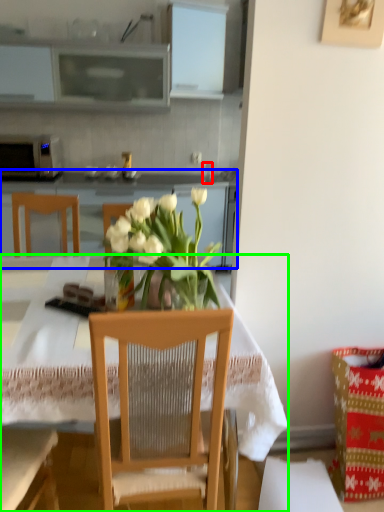
Question: Which object is the closest to the coffee cup (highlighted by a red box)? Choose among these: cabinetry (highlighted by a blue box) or desk (highlighted by a green box).

Choices:
 (A) cabinetry
 (B) desk

Answer: (A)